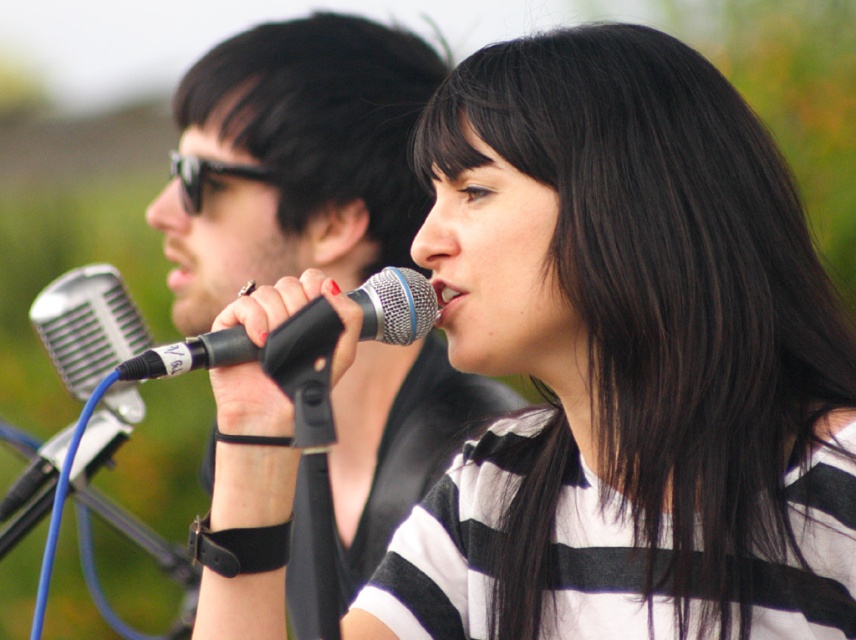
Does black metallic microphone at center have a smaller size compared to black plastic goggles at upper left?

No.

From the picture: Is black metallic microphone at center below black plastic goggles at upper left?

Yes.

Is point (233, 349) behind point (191, 163)?

No, (233, 349) is closer to viewer.

Locate an element on the screen. black metallic microphone at center is located at coordinates (247, 349).

Who is shorter, black striped shirt at center or black metallic microphone at center?

Standing shorter between the two is black metallic microphone at center.

Between black striped shirt at center and black metallic microphone at center, which one is positioned higher?

black metallic microphone at center is above.

Is point (758, 561) less distant than point (308, 336)?

That is False.

Image resolution: width=856 pixels, height=640 pixels. What are the coordinates of `black striped shirt at center` in the screenshot? It's located at (637, 365).

Does black striped shirt at center appear on the left side of matte black microphone at left?

Incorrect, black striped shirt at center is not on the left side of matte black microphone at left.

Does black striped shirt at center have a greater width compared to matte black microphone at left?

No, black striped shirt at center is not wider than matte black microphone at left.

Find the location of `black striped shirt at center`. black striped shirt at center is located at coordinates (637, 365).